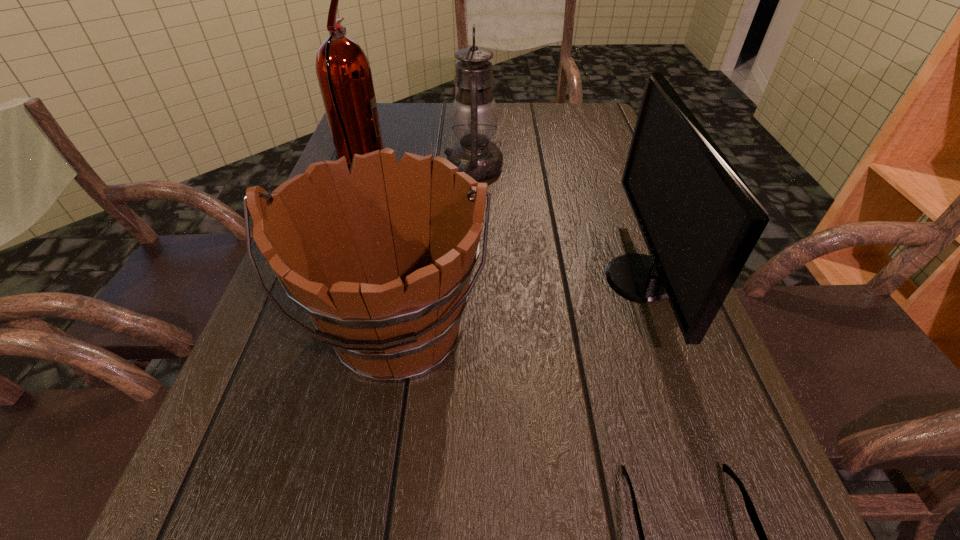
Locate an element on the screen. fire extinguisher is located at coordinates (343, 71).

I want to click on oil lamp, so click(474, 116).

The width and height of the screenshot is (960, 540). I want to click on computer monitor, so click(700, 221).

At what (x,y) coordinates should I click in order to perform the action: click on wine bucket. Please return your answer as a coordinate pair (x, y). This screenshot has width=960, height=540. Looking at the image, I should click on (380, 257).

Find the location of `free space located 0.050m on the front-facing side of the fire extinguisher`. free space located 0.050m on the front-facing side of the fire extinguisher is located at coordinates (405, 173).

Where is `vacant area located 0.270m on the right of the oil lamp`? Image resolution: width=960 pixels, height=540 pixels. vacant area located 0.270m on the right of the oil lamp is located at coordinates coord(604,168).

Locate an element on the screen. The width and height of the screenshot is (960, 540). vacant space located on the front-facing side of the computer monitor is located at coordinates (416, 278).

Locate an element on the screen. This screenshot has height=540, width=960. vacant space situated on the front-facing side of the computer monitor is located at coordinates (571, 278).

Locate an element on the screen. free space located 0.240m on the front-facing side of the computer monitor is located at coordinates (486, 278).

Locate an element on the screen. free point located 0.140m with the handle on the wine bucket is located at coordinates (366, 508).